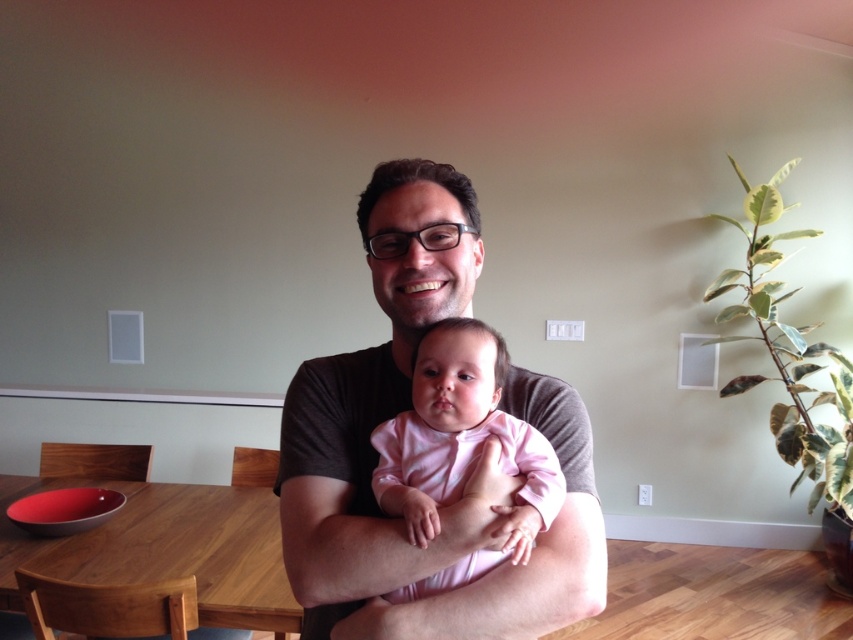
Does matte black shirt at center appear over pink matte onesie at center?

Correct, matte black shirt at center is located above pink matte onesie at center.

Describe the element at coordinates (407, 408) in the screenshot. I see `matte black shirt at center` at that location.

Find the location of a particular element. The image size is (853, 640). matte black shirt at center is located at coordinates (407, 408).

Who is positioned more to the left, wooden table at lower left or pink matte onesie at center?

Positioned to the left is wooden table at lower left.

Does point (173, 529) come in front of point (399, 500)?

No, it is behind (399, 500).

Is point (277, 513) positioned before point (439, 344)?

That is False.

Locate an element on the screen. This screenshot has height=640, width=853. wooden table at lower left is located at coordinates (165, 548).

Which is more to the right, matte black shirt at center or wooden table at lower left?

matte black shirt at center is more to the right.

Is matte black shirt at center smaller than wooden table at lower left?

Yes.

Does point (537, 387) lie in front of point (251, 595)?

That is True.

This screenshot has width=853, height=640. What are the coordinates of `matte black shirt at center` in the screenshot? It's located at (407, 408).